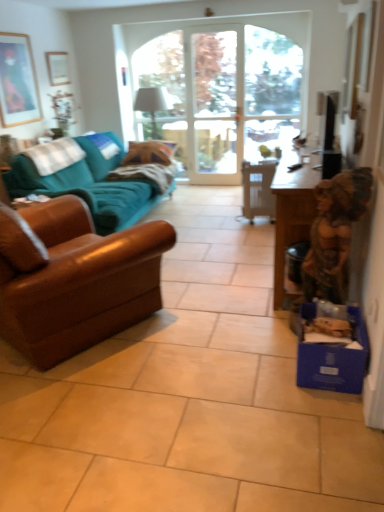
Find the location of a particular element. The image size is (384, 512). free point to the left of blue cardboard box at lower right is located at coordinates (266, 365).